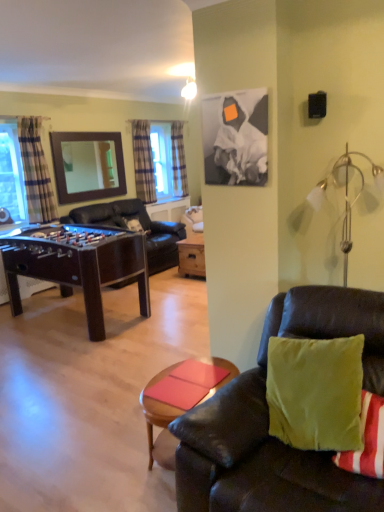
Where is `vacant area situated to the left side of smooth wooden coffee table at lower center`? This screenshot has height=512, width=384. vacant area situated to the left side of smooth wooden coffee table at lower center is located at coordinates (104, 463).